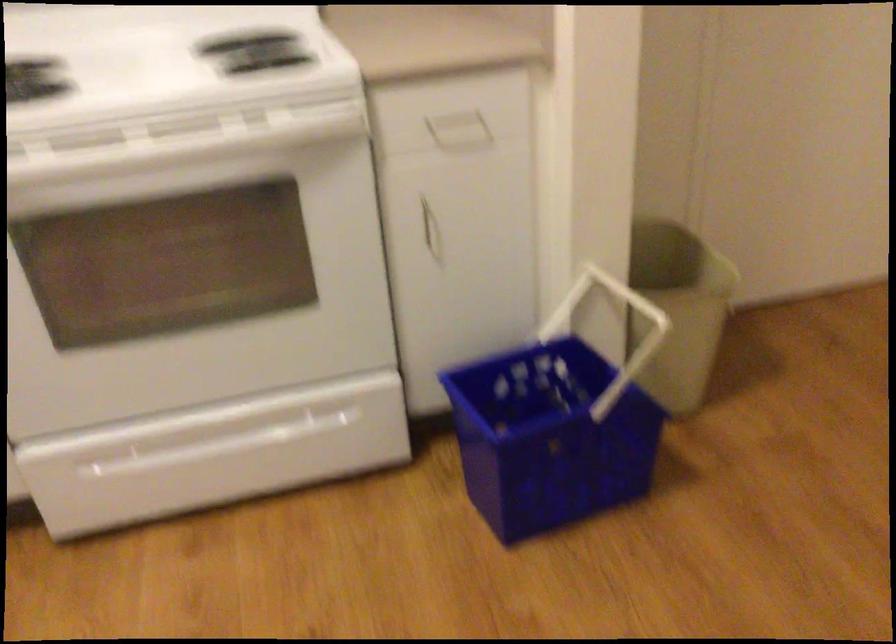
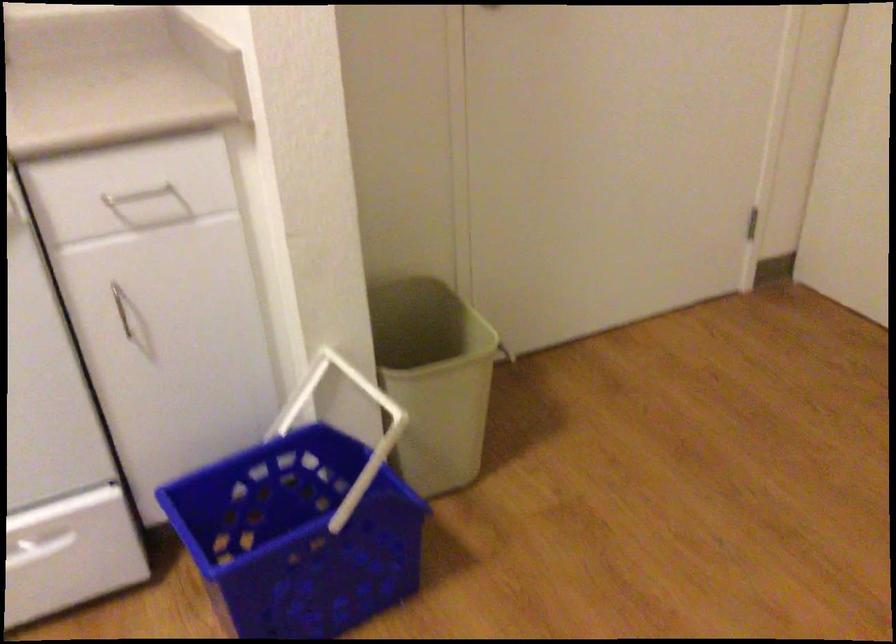
Locate, in the second image, the point that corresponds to (x=451, y=111) in the first image.

(138, 194)